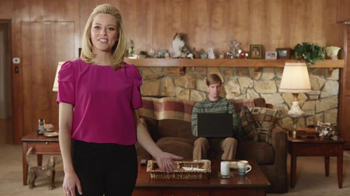
Find the location of a particular element. This screenshot has height=196, width=350. laptop is located at coordinates (212, 122).